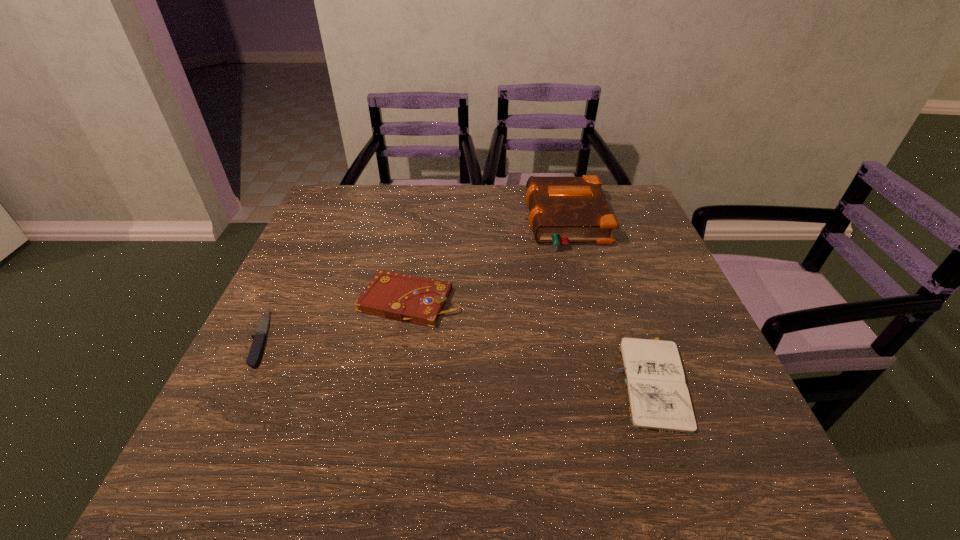
This screenshot has height=540, width=960. Identify the location of blank space located 0.320m on the spine side of the farthest object. (416, 222).

At what (x,y) coordinates should I click in order to perform the action: click on vacant area situated on the right of the third shortest object. Please return your answer as a coordinate pair (x, y). Image resolution: width=960 pixels, height=540 pixels. Looking at the image, I should click on [503, 300].

The height and width of the screenshot is (540, 960). In order to click on vacant area situated on the left of the nearer notebook in this screenshot , I will do `click(434, 381)`.

Where is `vacant space located on the back of the steak knife`? vacant space located on the back of the steak knife is located at coordinates (317, 226).

Find the location of a particular element. object located in the far edge section of the desktop is located at coordinates (563, 210).

You are a GUI agent. You are given a task and a screenshot of the screen. Output one action in this format:
    pyautogui.click(x=<x>, y=<y>)
    Task: Click on the object at the left edge
    
    Given the screenshot: What is the action you would take?
    pyautogui.click(x=259, y=339)

Identify the location of Bible that is at the right edge. The height and width of the screenshot is (540, 960). (563, 210).

Image resolution: width=960 pixels, height=540 pixels. In order to click on notebook situated at the right edge in this screenshot , I will do `click(658, 397)`.

This screenshot has height=540, width=960. I want to click on object at the far right corner, so click(x=563, y=210).

Locate an element on the screen. This screenshot has height=540, width=960. vacant space at the far edge of the desktop is located at coordinates (485, 208).